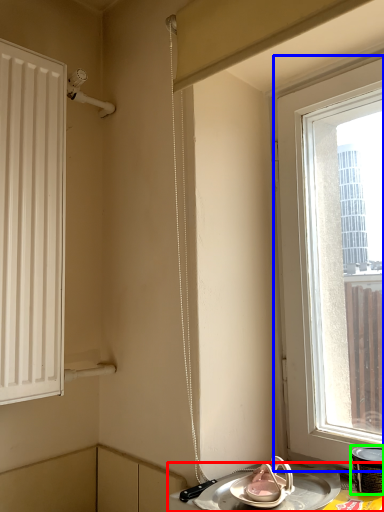
Question: Considering the real-world distances, which object is farthest from table (highlighted by a red box)? window (highlighted by a blue box) or appliance (highlighted by a green box)?

Choices:
 (A) window
 (B) appliance

Answer: (A)